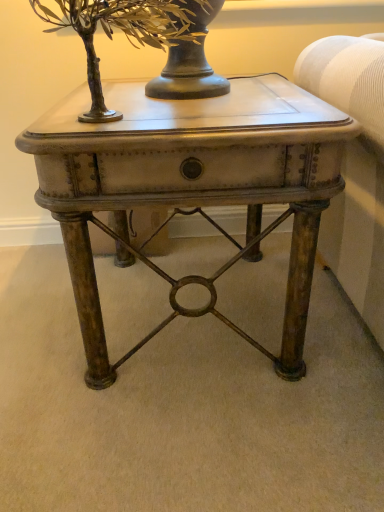
Question: Could you tell me if green metallic tree at upper center is turned towards matte brown side table at center?

Choices:
 (A) yes
 (B) no

Answer: (B)

Question: From the image's perspective, is green metallic tree at upper center located beneath matte brown side table at center?

Choices:
 (A) yes
 (B) no

Answer: (B)

Question: Are green metallic tree at upper center and matte brown side table at center making contact?

Choices:
 (A) yes
 (B) no

Answer: (B)

Question: Is the depth of green metallic tree at upper center less than that of matte brown side table at center?

Choices:
 (A) no
 (B) yes

Answer: (B)

Question: Can you confirm if green metallic tree at upper center is bigger than matte brown side table at center?

Choices:
 (A) no
 (B) yes

Answer: (A)

Question: Does green metallic tree at upper center have a greater width compared to matte brown side table at center?

Choices:
 (A) yes
 (B) no

Answer: (B)

Question: Does matte brown side table at center contain green metallic tree at upper center?

Choices:
 (A) yes
 (B) no

Answer: (B)

Question: Is matte brown side table at center positioned before green metallic tree at upper center?

Choices:
 (A) no
 (B) yes

Answer: (A)

Question: From a real-world perspective, is matte brown side table at center under green metallic tree at upper center?

Choices:
 (A) yes
 (B) no

Answer: (A)

Question: Is matte brown side table at center not close to green metallic tree at upper center?

Choices:
 (A) yes
 (B) no

Answer: (B)

Question: Does matte brown side table at center have a lesser width compared to green metallic tree at upper center?

Choices:
 (A) yes
 (B) no

Answer: (B)

Question: Is matte brown side table at center bigger than green metallic tree at upper center?

Choices:
 (A) no
 (B) yes

Answer: (B)

Question: In terms of height, does green metallic tree at upper center look taller or shorter compared to matte brown side table at center?

Choices:
 (A) tall
 (B) short

Answer: (B)